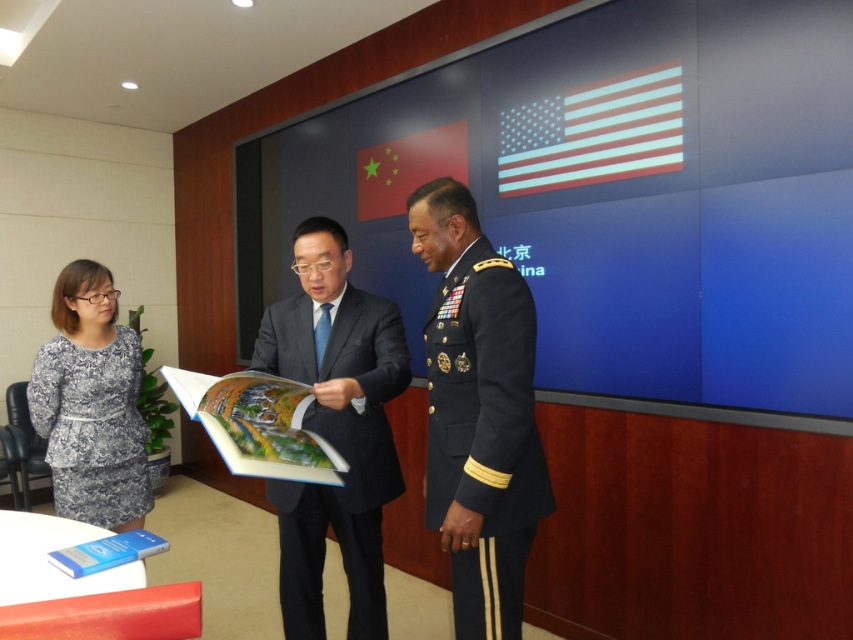
From the picture: Which is more to the right, dark blue fabric military uniform at right or printed fabric dress at left?

dark blue fabric military uniform at right is more to the right.

Is dark blue fabric military uniform at right positioned behind printed fabric dress at left?

No, dark blue fabric military uniform at right is in front of printed fabric dress at left.

Is point (518, 508) closer to camera compared to point (88, 500)?

Yes, it is.

Where is `dark blue fabric military uniform at right`? The image size is (853, 640). dark blue fabric military uniform at right is located at coordinates (485, 435).

From the picture: Who is taller, dark blue fabric military uniform at right or dark blue military uniform at center?

dark blue military uniform at center is taller.

You are a GUI agent. You are given a task and a screenshot of the screen. Output one action in this format:
    pyautogui.click(x=<x>, y=<y>)
    Task: Click on the dark blue fabric military uniform at right
    Image resolution: width=853 pixels, height=640 pixels.
    Given the screenshot: What is the action you would take?
    pyautogui.click(x=485, y=435)

Is dark blue military uniform at center bigger than printed fabric dress at left?

Yes, dark blue military uniform at center is bigger than printed fabric dress at left.

Which of these two, dark blue military uniform at center or printed fabric dress at left, stands shorter?

printed fabric dress at left is shorter.

Where is `dark blue military uniform at center`? This screenshot has height=640, width=853. dark blue military uniform at center is located at coordinates (339, 452).

Image resolution: width=853 pixels, height=640 pixels. In order to click on dark blue military uniform at center in this screenshot , I will do `click(339, 452)`.